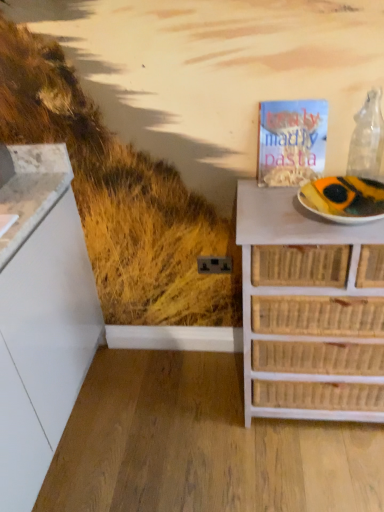
Find the location of a particular element. vacant space positioned to the left of white wicker chest of drawers at right is located at coordinates point(191,418).